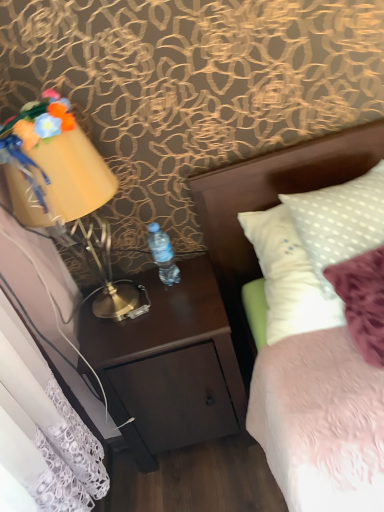
I want to click on vacant area to the left of clear plastic bottle at center, so click(135, 295).